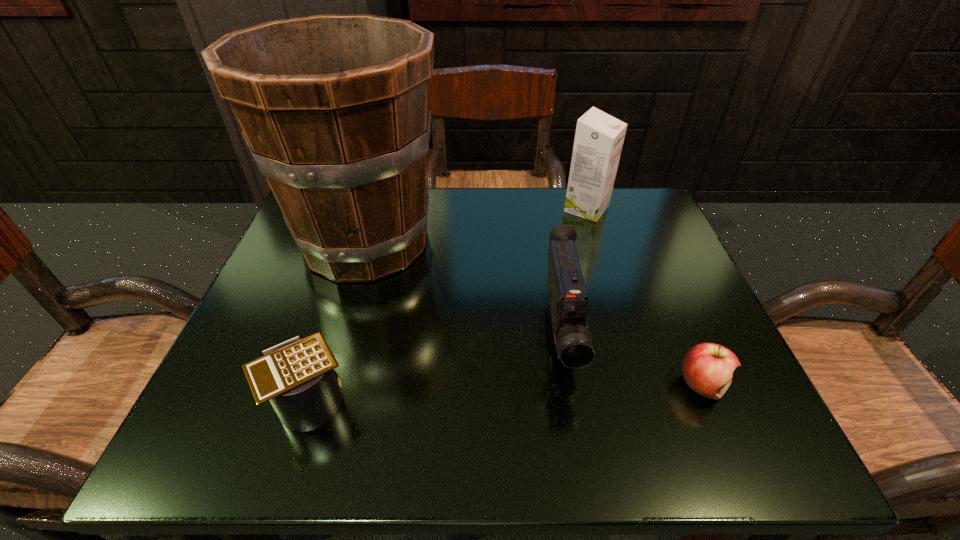
Where is `apple located at the right edge`? Image resolution: width=960 pixels, height=540 pixels. apple located at the right edge is located at coordinates (707, 368).

I want to click on object present at the far left corner, so click(335, 109).

The width and height of the screenshot is (960, 540). Find the location of `object that is at the near left corner`. object that is at the near left corner is located at coordinates (297, 376).

Locate an element on the screen. The height and width of the screenshot is (540, 960). object that is at the far right corner is located at coordinates (599, 137).

Locate an element on the screen. The height and width of the screenshot is (540, 960). object present at the near right corner is located at coordinates (707, 368).

I want to click on vacant position at the far edge of the desktop, so click(x=584, y=234).

Locate an element on the screen. This screenshot has width=960, height=540. vacant space at the left edge of the desktop is located at coordinates (334, 309).

You are a GUI agent. You are given a task and a screenshot of the screen. Output one action in this format:
    pyautogui.click(x=<x>, y=<y>)
    Task: Click on the vacant space at the right edge of the desktop
    
    Given the screenshot: What is the action you would take?
    pyautogui.click(x=638, y=259)

The width and height of the screenshot is (960, 540). In order to click on free point at the far right corner in this screenshot , I will do `click(647, 225)`.

The height and width of the screenshot is (540, 960). In order to click on free point at the near right corner in this screenshot , I will do `click(713, 422)`.